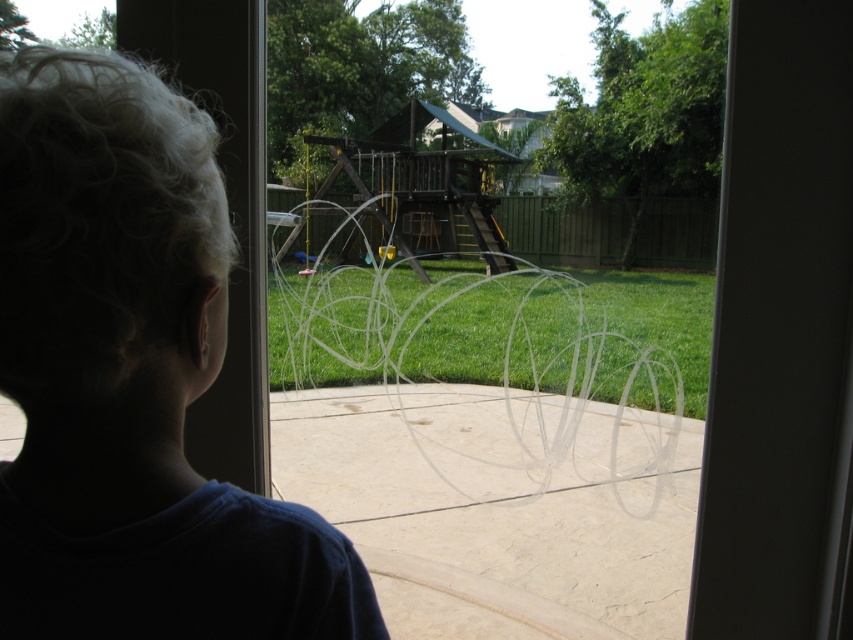
In the scene shown: Which of these two, dark blue shirt at left or green grass at center, stands taller?

green grass at center

Is point (235, 637) farther from camera compared to point (606, 348)?

No, it is in front of (606, 348).

What do you see at coordinates (132, 380) in the screenshot?
I see `dark blue shirt at left` at bounding box center [132, 380].

Locate an element on the screen. This screenshot has height=640, width=853. dark blue shirt at left is located at coordinates click(132, 380).

Can you confirm if transparent plastic screen door at center is taller than green grass at center?

In fact, transparent plastic screen door at center may be shorter than green grass at center.

Who is more forward, (838, 516) or (434, 324)?

Positioned in front is point (838, 516).

This screenshot has height=640, width=853. Identify the location of transparent plastic screen door at center. (780, 336).

Between point (161, 134) and point (785, 225), which one is positioned behind?

Positioned behind is point (785, 225).

Measure the distance between dark blue shirt at left and camera.

dark blue shirt at left and camera are 17.68 inches apart from each other.

Locate an element on the screen. This screenshot has height=640, width=853. dark blue shirt at left is located at coordinates (132, 380).